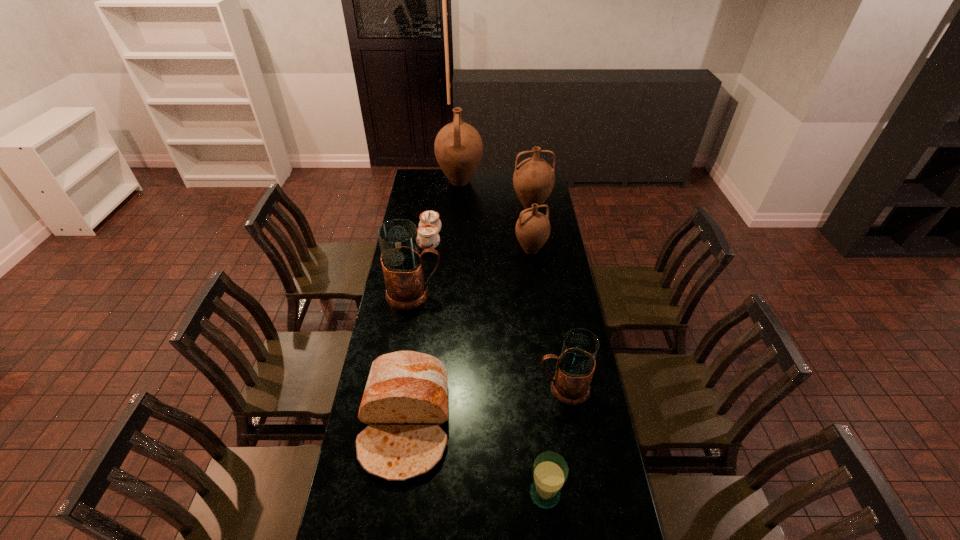
At what (x,y) coordinates should I click in order to perform the action: click on empty space between the left gray pitcher and the third nearest pitcher. Please return your answer as a coordinate pair (x, y). The width and height of the screenshot is (960, 540). Looking at the image, I should click on (472, 272).

Identify the location of vacant space that is in between the smallest brown pitcher and the farthest pitcher. (495, 216).

Where is `vacant point located between the blue glass and the bread`? The height and width of the screenshot is (540, 960). vacant point located between the blue glass and the bread is located at coordinates (475, 459).

Image resolution: width=960 pixels, height=540 pixels. I want to click on unoccupied position between the third farthest pitcher and the nearer gray pitcher, so click(547, 319).

Where is `free spot between the chinaware and the third farthest pitcher`? free spot between the chinaware and the third farthest pitcher is located at coordinates (480, 246).

Where is `free space that is in between the nearer gray pitcher and the nearest brown pitcher`? The height and width of the screenshot is (540, 960). free space that is in between the nearer gray pitcher and the nearest brown pitcher is located at coordinates (547, 319).

Where is `vacant region between the nearest pitcher and the second farthest brown pitcher`? vacant region between the nearest pitcher and the second farthest brown pitcher is located at coordinates (547, 298).

At what (x,y) coordinates should I click in order to perform the action: click on vacant space in between the blue glass and the white chinaware. Please return your answer as a coordinate pair (x, y). This screenshot has width=960, height=540. Looking at the image, I should click on (488, 367).

Where is `vacant point located between the smaller gray pitcher and the farthest object`? This screenshot has height=540, width=960. vacant point located between the smaller gray pitcher and the farthest object is located at coordinates (512, 285).

Identify which object is the fifth nearest to the leftmost brown pitcher. Please provide its 2D coordinates. Your answer should be formatted as a tuple, i.e. [(x, y)], where the tuple contains the x and y coordinates of a point satisfying the conditions above.

[(405, 400)]